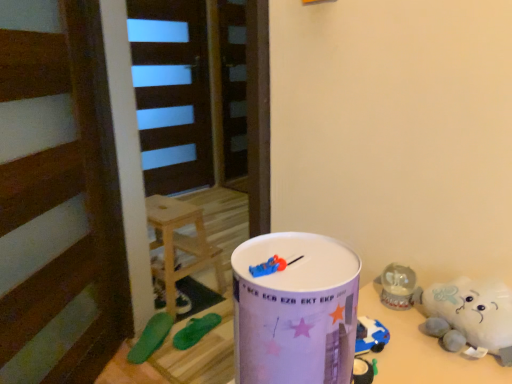
At what (x,y) coordinates should I click in order to perform the action: click on free space to the back side of green rubber toy at lower left, arranged as the third toy when viewed from the front. Please return your answer as a coordinate pair (x, y). This screenshot has height=384, width=512. Looking at the image, I should click on (186, 287).